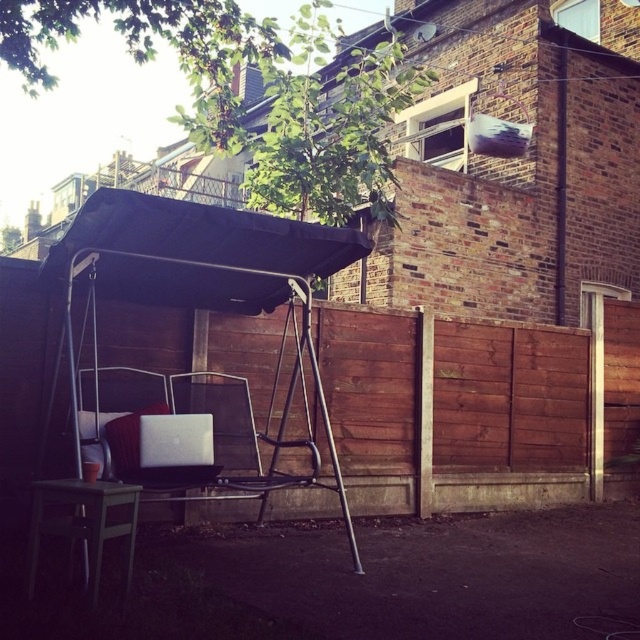
Identify the location of black fabric canopy at center. (198, 252).

Does black fabric canopy at center appear over silver metallic laptop at center?

Yes, black fabric canopy at center is above silver metallic laptop at center.

Find the location of `black fabric canopy at center`. black fabric canopy at center is located at coordinates (198, 252).

Is point (58, 497) closer to viewer compared to point (248, 424)?

Yes, point (58, 497) is closer to viewer.

Measure the distance between green matte stool at lower left and camera.

green matte stool at lower left and camera are 8.32 feet apart.

At what (x,y) coordinates should I click in order to perform the action: click on green matte stool at lower left. Please return your answer as a coordinate pair (x, y). Image resolution: width=640 pixels, height=640 pixels. Looking at the image, I should click on (83, 522).

At what (x,y) coordinates should I click in order to perform the action: click on black metal swing at center. Please return your answer as a coordinate pair (x, y). Looking at the image, I should click on (211, 280).

Which is more to the left, black metal swing at center or black fabric canopy at center?

black fabric canopy at center

You are a GUI agent. You are given a task and a screenshot of the screen. Output one action in this format:
    pyautogui.click(x=<x>, y=<y>)
    Task: Click on the black metal swing at center
    The image size is (640, 640).
    Given the screenshot: What is the action you would take?
    pyautogui.click(x=211, y=280)